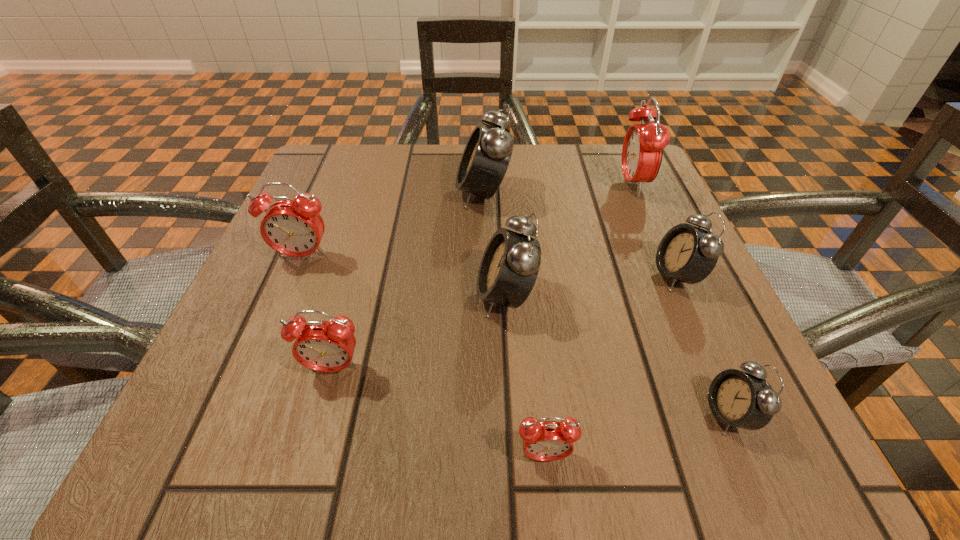
Locate an element on the screen. This screenshot has height=540, width=960. the closest alarm clock to the farthest white alarm clock is located at coordinates (510, 264).

Choose which alarm clock is the nearest neighbor to the second nearest alarm clock. Please provide its 2D coordinates. Your answer should be formatted as a tuple, i.e. [(x, y)], where the tuple contains the x and y coordinates of a point satisfying the conditions above.

[(686, 253)]

Identify the location of red alarm clock that stands as the second closest to the farthest white alarm clock. (643, 145).

Identify the location of the closest red alarm clock to the nearest white alarm clock. (548, 440).

Identify which white alarm clock is located as the third nearest to the biggest white alarm clock. Please provide its 2D coordinates. Your answer should be formatted as a tuple, i.e. [(x, y)], where the tuple contains the x and y coordinates of a point satisfying the conditions above.

[(745, 400)]

In order to click on white alarm clock object that ranks as the second closest to the second nearest alarm clock in this screenshot , I will do `click(510, 264)`.

Where is `free spot that satisfies the following two spatial constraints: 1. on the face of the second smallest white alarm clock; 2. on the face of the nearest object`? free spot that satisfies the following two spatial constraints: 1. on the face of the second smallest white alarm clock; 2. on the face of the nearest object is located at coordinates (757, 455).

Locate an element on the screen. This screenshot has height=540, width=960. vacant area in the image that satisfies the following two spatial constraints: 1. on the face of the rightmost red alarm clock; 2. on the face of the smallest red alarm clock is located at coordinates (751, 455).

The image size is (960, 540). I want to click on free region that satisfies the following two spatial constraints: 1. on the face of the biggest red alarm clock; 2. on the face of the third smallest red alarm clock, so pyautogui.click(x=663, y=256).

You are a GUI agent. You are given a task and a screenshot of the screen. Output one action in this format:
    pyautogui.click(x=<x>, y=<y>)
    Task: Click on the free location that satisfies the following two spatial constraints: 1. on the face of the biggest white alarm clock; 2. on the face of the leftmost object
    The width and height of the screenshot is (960, 540).
    Given the screenshot: What is the action you would take?
    pyautogui.click(x=484, y=256)